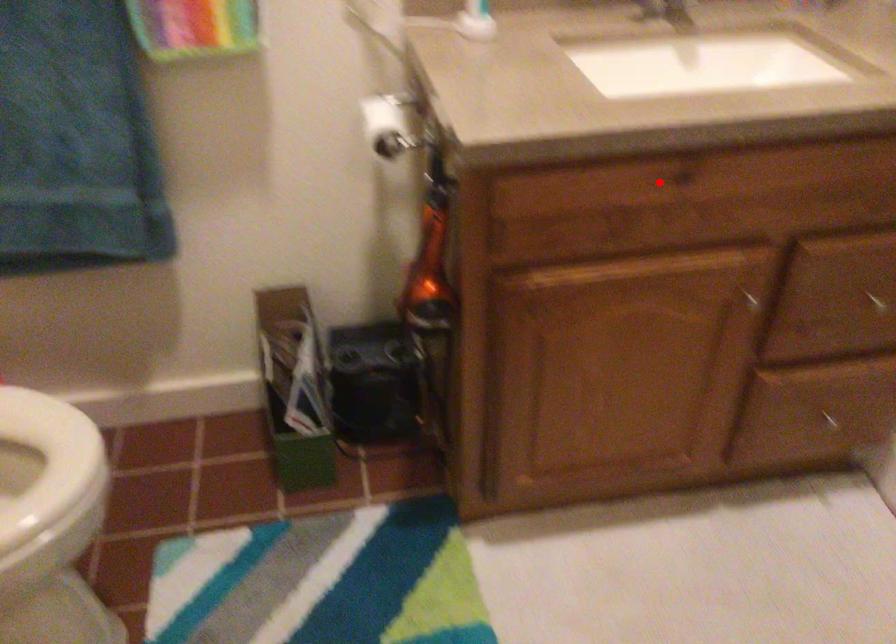
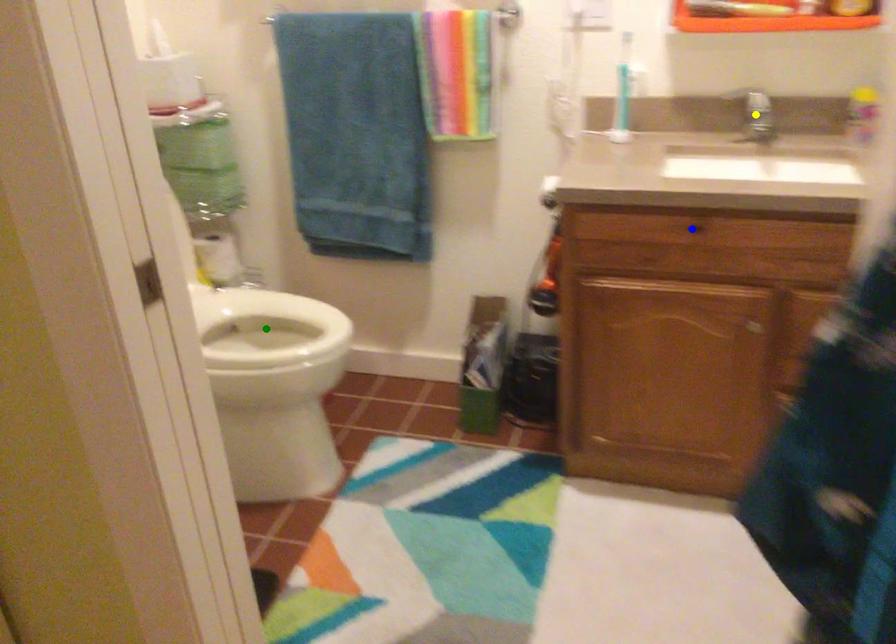
Question: I am providing you with two images of the same scene from different viewpoints. A red point is marked on the first image. You are given multiple points on the second image. In image 2, which mark is for the same physical point as the one in image 1?

Choices:
 (A) green point
 (B) blue point
 (C) yellow point

Answer: (B)